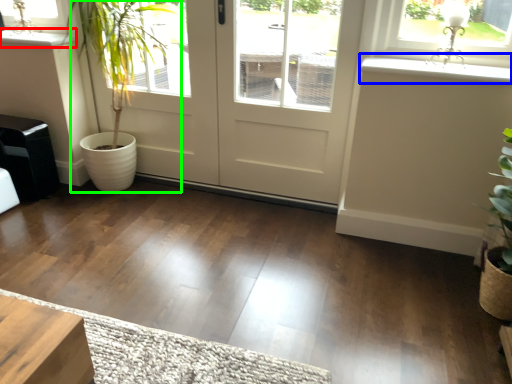
Question: Which object is positioned closest to window sill (highlighted by a red box)? Select from window sill (highlighted by a blue box) and houseplant (highlighted by a green box).

Choices:
 (A) window sill
 (B) houseplant

Answer: (B)